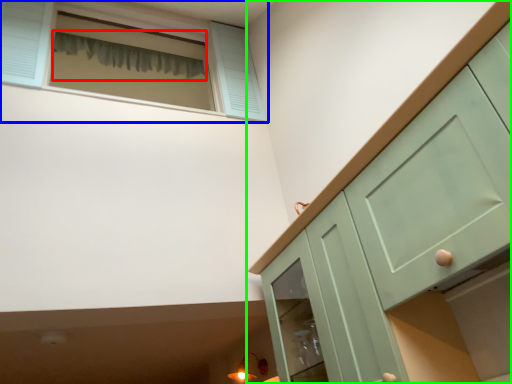
Question: Estimate the real-world distances between objects in this image. Which object is farther from curtain (highlighted by a red box), window (highlighted by a blue box) or cabinetry (highlighted by a green box)?

Choices:
 (A) window
 (B) cabinetry

Answer: (B)